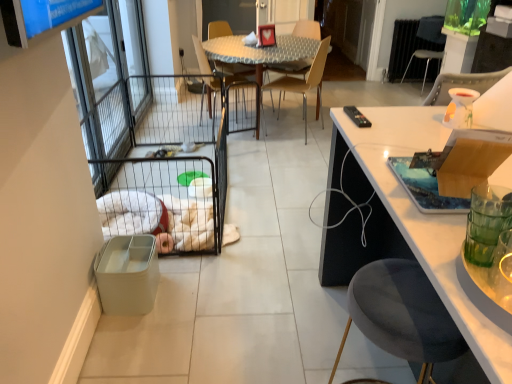
Question: Which direction should I rotate to look at metallic silver chair at center, acting as the fourth chair starting from the right?

Choices:
 (A) left
 (B) right

Answer: (A)

Question: Is clear glass screen door at left inside wooden cutting board at right?

Choices:
 (A) yes
 (B) no

Answer: (B)

Question: Is wooden cutting board at right not within clear glass screen door at left?

Choices:
 (A) yes
 (B) no

Answer: (A)

Question: Can you confirm if wooden cutting board at right is shorter than clear glass screen door at left?

Choices:
 (A) yes
 (B) no

Answer: (A)

Question: From a real-world perspective, is wooden cutting board at right beneath clear glass screen door at left?

Choices:
 (A) no
 (B) yes

Answer: (A)

Question: Is the position of wooden cutting board at right more distant than that of clear glass screen door at left?

Choices:
 (A) no
 (B) yes

Answer: (A)

Question: Does wooden cutting board at right turn towards clear glass screen door at left?

Choices:
 (A) no
 (B) yes

Answer: (A)

Question: Considering the relative sizes of matte plastic trash bin at lower left and clear glass screen door at left in the image provided, is matte plastic trash bin at lower left smaller than clear glass screen door at left?

Choices:
 (A) no
 (B) yes

Answer: (B)

Question: From the image's perspective, is matte plastic trash bin at lower left located beneath clear glass screen door at left?

Choices:
 (A) yes
 (B) no

Answer: (A)

Question: Is matte plastic trash bin at lower left looking in the opposite direction of clear glass screen door at left?

Choices:
 (A) yes
 (B) no

Answer: (B)

Question: Is matte plastic trash bin at lower left to the left of clear glass screen door at left from the viewer's perspective?

Choices:
 (A) no
 (B) yes

Answer: (A)

Question: Is matte plastic trash bin at lower left surrounding clear glass screen door at left?

Choices:
 (A) yes
 (B) no

Answer: (B)

Question: Is the position of matte plastic trash bin at lower left less distant than that of clear glass screen door at left?

Choices:
 (A) yes
 (B) no

Answer: (A)

Question: Does light brown wood chair at center, which ranks as the second chair in front-to-back order, appear on the left side of metallic silver chair at upper right, marked as the first chair in a top-to-bottom arrangement?

Choices:
 (A) no
 (B) yes

Answer: (B)